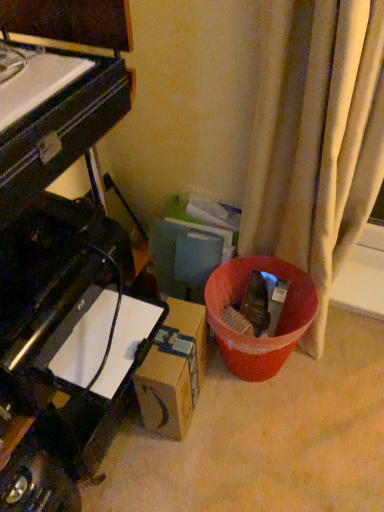
Question: Considering the relative positions of black glossy piano at left and brown cardboard box at lower center in the image provided, is black glossy piano at left to the right of brown cardboard box at lower center from the viewer's perspective?

Choices:
 (A) no
 (B) yes

Answer: (A)

Question: Can you confirm if black glossy piano at left is smaller than brown cardboard box at lower center?

Choices:
 (A) no
 (B) yes

Answer: (A)

Question: Considering the relative sizes of black glossy piano at left and brown cardboard box at lower center in the image provided, is black glossy piano at left shorter than brown cardboard box at lower center?

Choices:
 (A) no
 (B) yes

Answer: (B)

Question: Is black glossy piano at left turned away from brown cardboard box at lower center?

Choices:
 (A) no
 (B) yes

Answer: (A)

Question: Does black glossy piano at left have a lesser width compared to brown cardboard box at lower center?

Choices:
 (A) yes
 (B) no

Answer: (B)

Question: Would you say black glossy piano at left is a long distance from brown cardboard box at lower center?

Choices:
 (A) no
 (B) yes

Answer: (A)

Question: From a real-world perspective, is brown cardboard box at lower center on black glossy piano at left?

Choices:
 (A) yes
 (B) no

Answer: (B)

Question: Considering the relative sizes of brown cardboard box at lower center and black glossy piano at left in the image provided, is brown cardboard box at lower center shorter than black glossy piano at left?

Choices:
 (A) no
 (B) yes

Answer: (A)

Question: Considering the relative sizes of brown cardboard box at lower center and black glossy piano at left in the image provided, is brown cardboard box at lower center taller than black glossy piano at left?

Choices:
 (A) yes
 (B) no

Answer: (A)

Question: Is black glossy piano at left surrounded by brown cardboard box at lower center?

Choices:
 (A) no
 (B) yes

Answer: (A)

Question: From the image's perspective, does brown cardboard box at lower center appear higher than black glossy piano at left?

Choices:
 (A) yes
 (B) no

Answer: (B)

Question: Is brown cardboard box at lower center wider than black glossy piano at left?

Choices:
 (A) yes
 (B) no

Answer: (B)

Question: From the image's perspective, is brown cardboard box at lower center located above or below black glossy piano at left?

Choices:
 (A) above
 (B) below

Answer: (B)